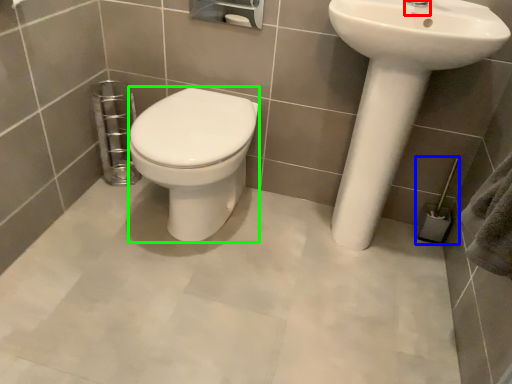
Question: Which is nearer to the plumbing fixture (highlighted by a red box)? towel bar (highlighted by a blue box) or bidet (highlighted by a green box).

Choices:
 (A) towel bar
 (B) bidet

Answer: (A)